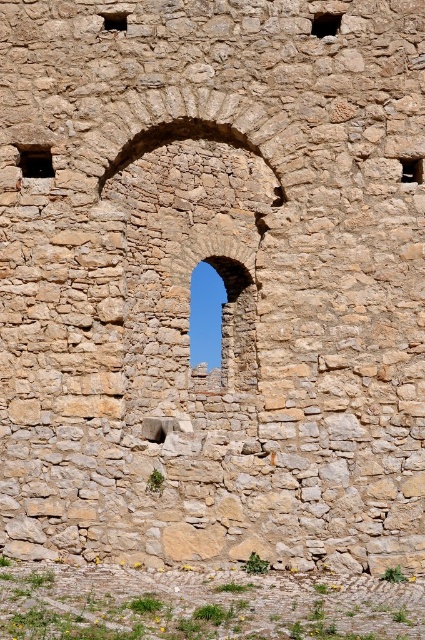
Question: Does stone window at upper center come in front of matte stone window at upper right?

Choices:
 (A) yes
 (B) no

Answer: (B)

Question: Estimate the real-world distances between objects in this image. Which object is farther from the brown stone window at upper left?

Choices:
 (A) matte stone window at upper left
 (B) stone window at upper center

Answer: (B)

Question: Which point is closer to the camera taking this photo?

Choices:
 (A) (110, 28)
 (B) (320, 20)
 (C) (25, 163)
 (D) (408, 170)

Answer: (D)

Question: Does brown stone window at upper left have a smaller size compared to stone window at upper center?

Choices:
 (A) yes
 (B) no

Answer: (B)

Question: Which of the following is the farthest from the observer?

Choices:
 (A) (31, 148)
 (B) (116, 20)
 (C) (311, 28)
 (D) (416, 161)

Answer: (B)

Question: Is brown stone window at upper left thinner than matte stone window at upper left?

Choices:
 (A) yes
 (B) no

Answer: (B)